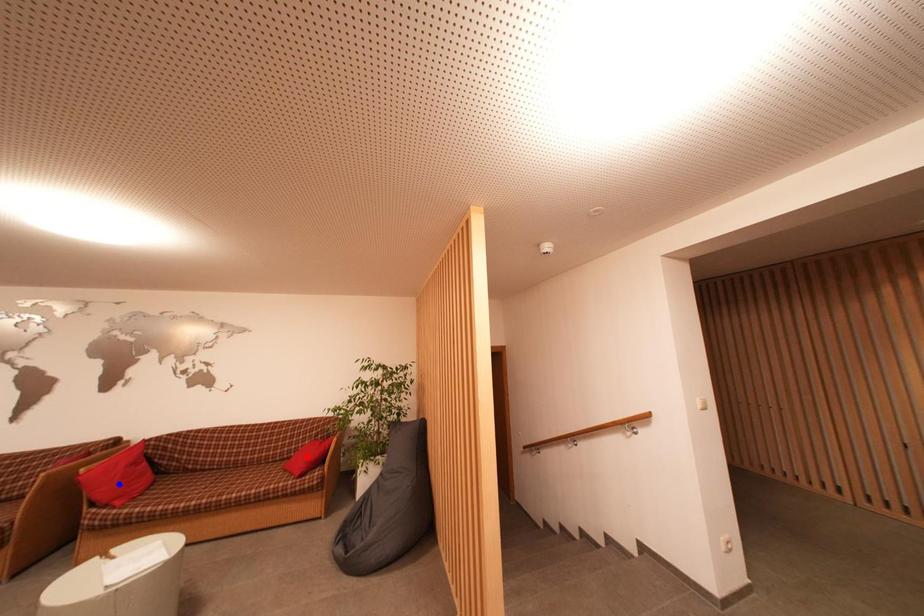
Question: Two points are marked on the image. Which point is closer to the camera?

Choices:
 (A) Blue point is closer.
 (B) Red point is closer.

Answer: (A)